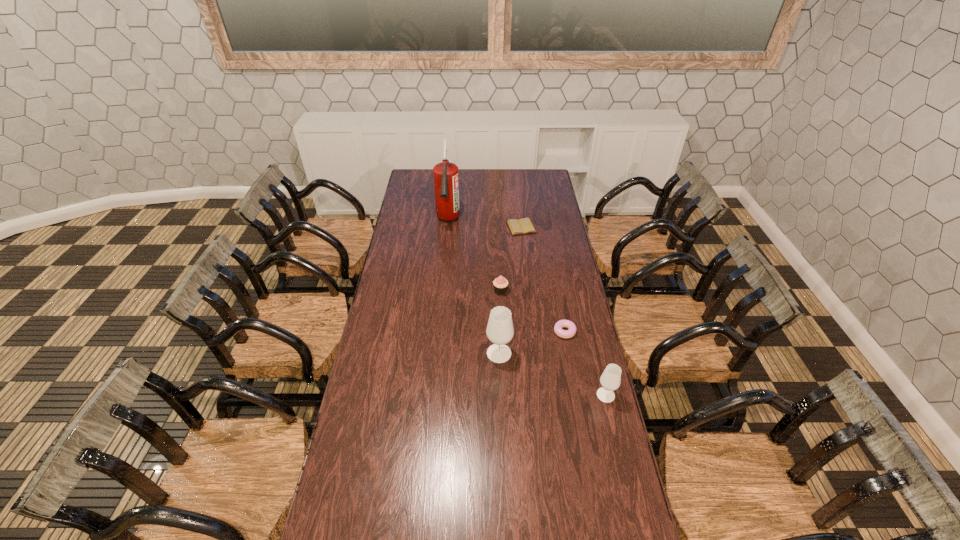
Locate an element on the screen. The image size is (960, 540). vacant point that satisfies the following two spatial constraints: 1. at the nozzle of the tallest object; 2. on the right side of the fourth nearest object is located at coordinates (442, 291).

The width and height of the screenshot is (960, 540). I want to click on free space that satisfies the following two spatial constraints: 1. at the nozzle of the tallest object; 2. on the left side of the farther glass, so coord(435,353).